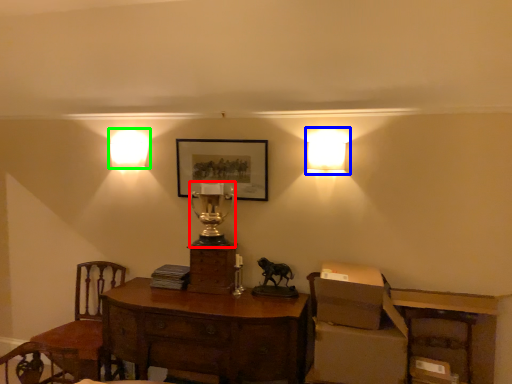
Question: Which is farther away from table lamp (highlighted by a red box)? lamp (highlighted by a blue box) or lamp (highlighted by a green box)?

Choices:
 (A) lamp
 (B) lamp

Answer: (A)